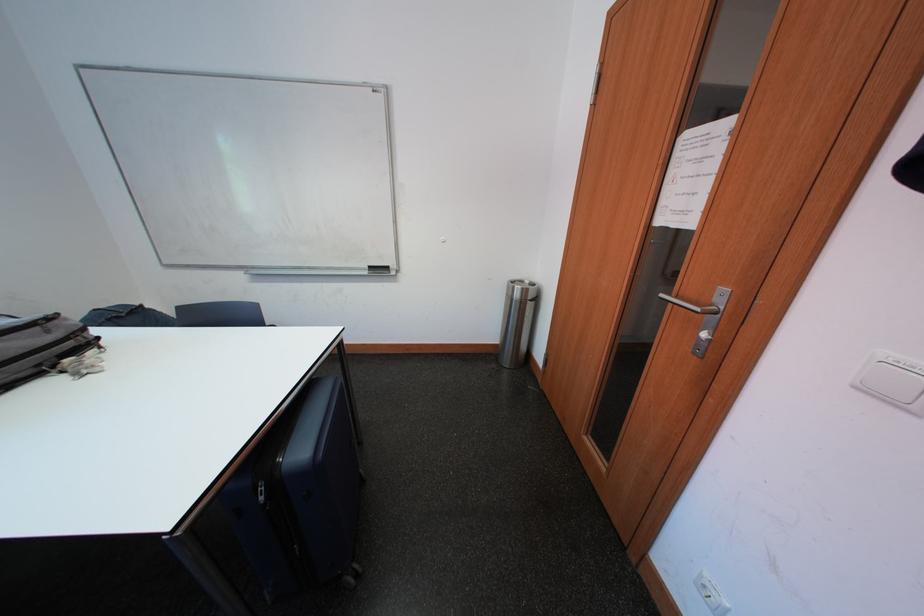
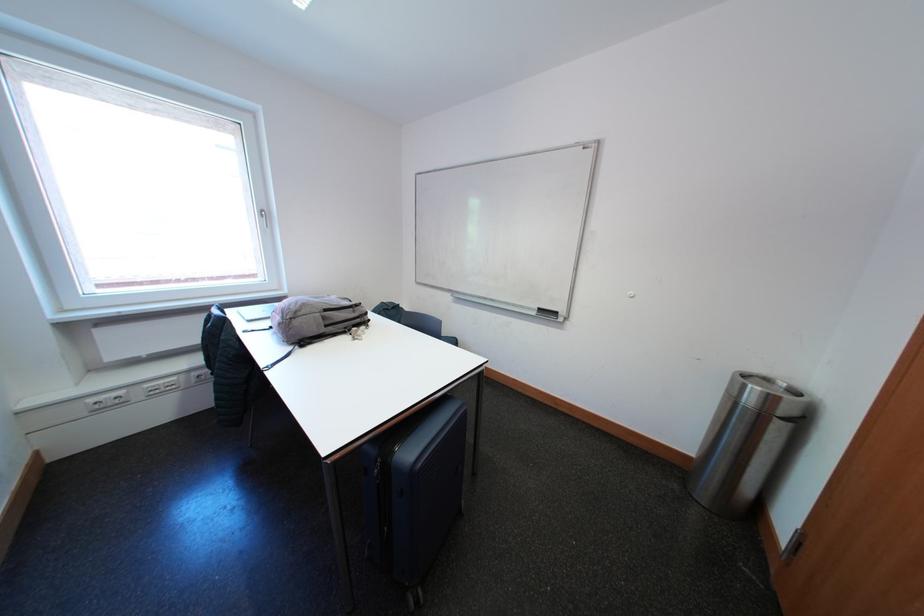
Question: The camera is either moving clockwise (left) or counter-clockwise (right) around the object. The first image is from the beginning of the video and the second image is from the end. Is the camera moving left or right when shooting the video?

Choices:
 (A) Left
 (B) Right

Answer: (B)